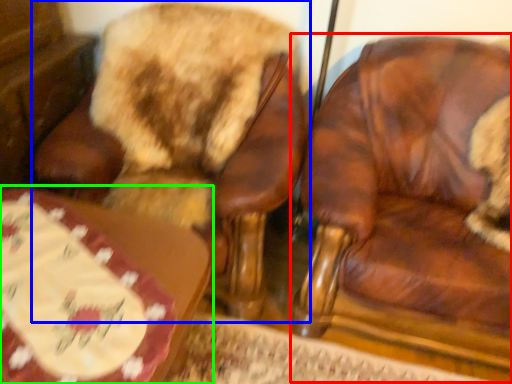
Question: Considering the real-world distances, which object is farthest from chair (highlighted by a red box)? chair (highlighted by a blue box) or table (highlighted by a green box)?

Choices:
 (A) chair
 (B) table

Answer: (B)